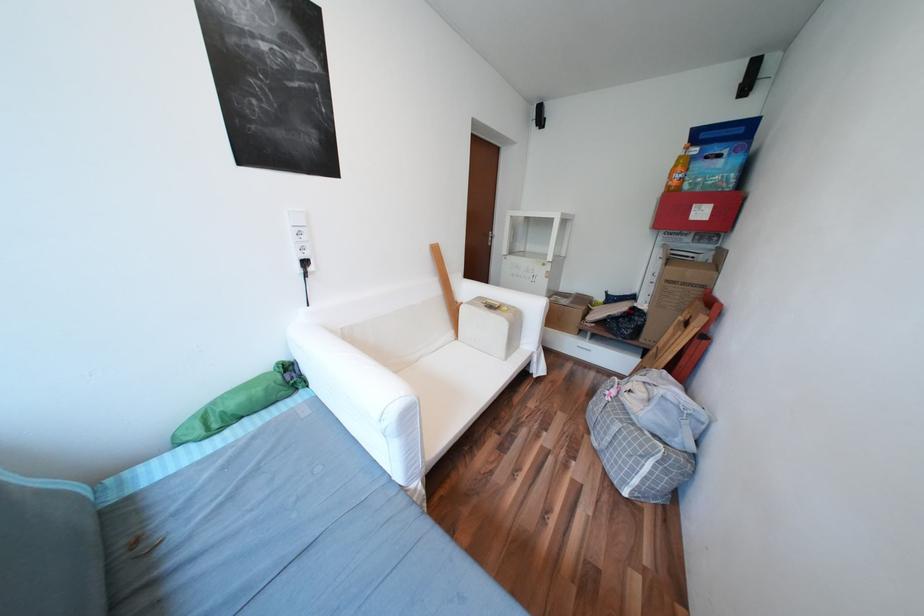
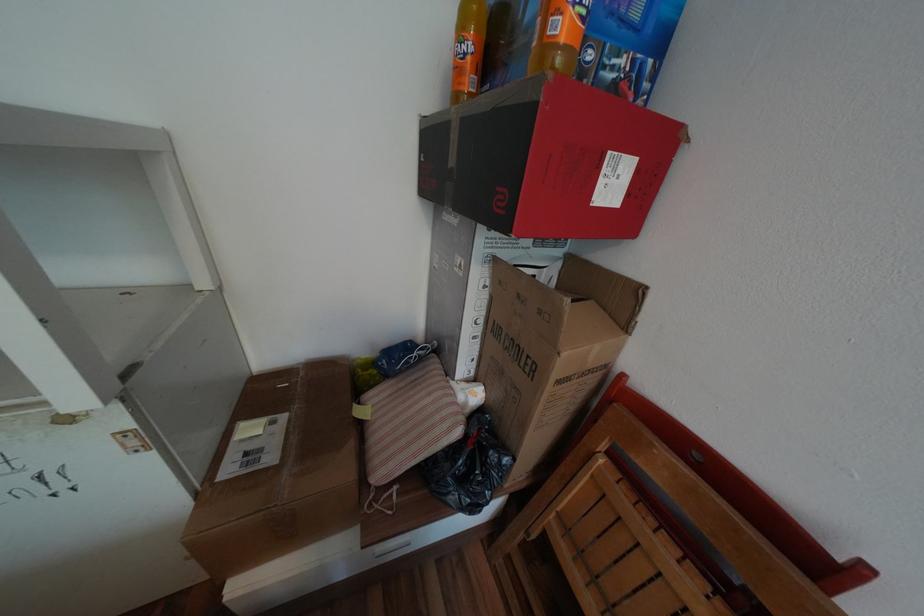
In the second image, find the point that corresponds to point (701, 213) in the first image.

(611, 182)